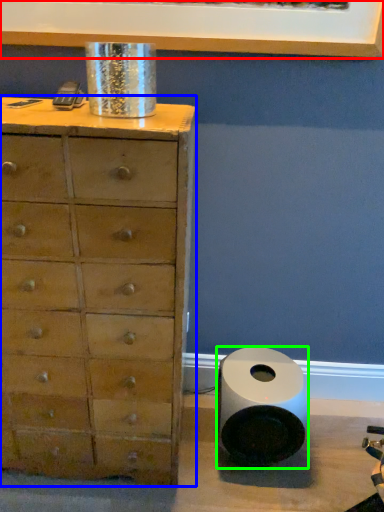
Question: Based on their relative distances, which object is farther from picture frame (highlighted by a red box)? Choose from chest of drawers (highlighted by a blue box) and speaker (highlighted by a green box).

Choices:
 (A) chest of drawers
 (B) speaker

Answer: (B)